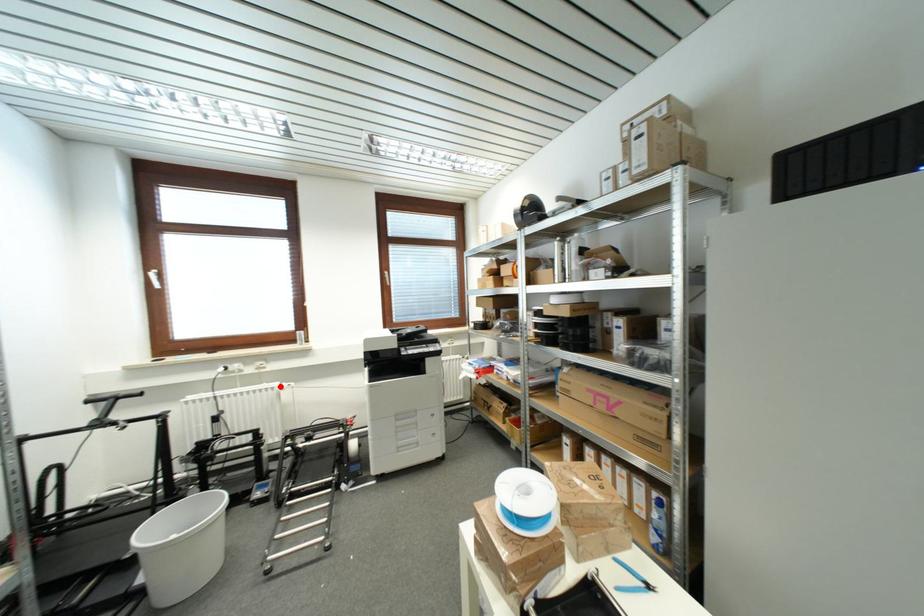
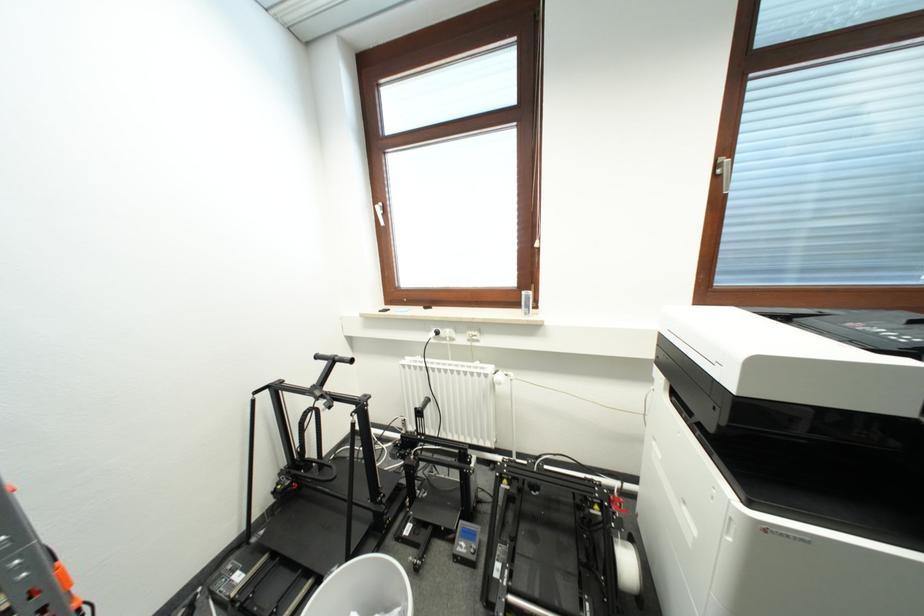
The point at the highlighted location is marked in the first image. Where is the corresponding point in the second image?

(494, 371)